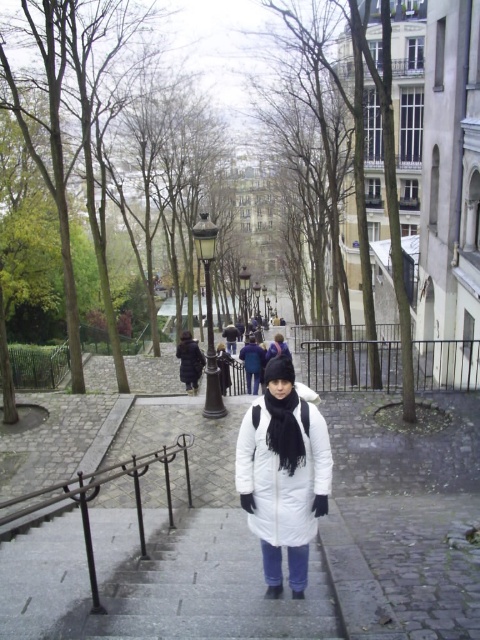
Is black metal rail at right thinner than black wrought iron railing at lower center?

No, black metal rail at right is not thinner than black wrought iron railing at lower center.

Which is above, black metal rail at right or black wrought iron railing at lower center?

black metal rail at right is higher up.

The height and width of the screenshot is (640, 480). I want to click on black metal rail at right, so click(352, 364).

Where is `black metal rail at right`? black metal rail at right is located at coordinates (352, 364).

Can you confirm if gray stone stairs at center is positioned to the left of black metal rail at right?

Yes, gray stone stairs at center is to the left of black metal rail at right.

Is point (178, 616) closer to camera compared to point (420, 358)?

Yes, it is.

Does point (182, 560) come in front of point (416, 346)?

Yes, it is in front of point (416, 346).

The image size is (480, 640). In order to click on gray stone stairs at center in this screenshot , I will do `click(202, 589)`.

Is point (288, 490) closer to viewer compared to point (437, 385)?

Yes, point (288, 490) is in front of point (437, 385).

Does point (244, 420) lie behind point (328, 352)?

No, (244, 420) is in front of (328, 352).

The image size is (480, 640). What are the coordinates of `white matte jacket at center` in the screenshot? It's located at (283, 474).